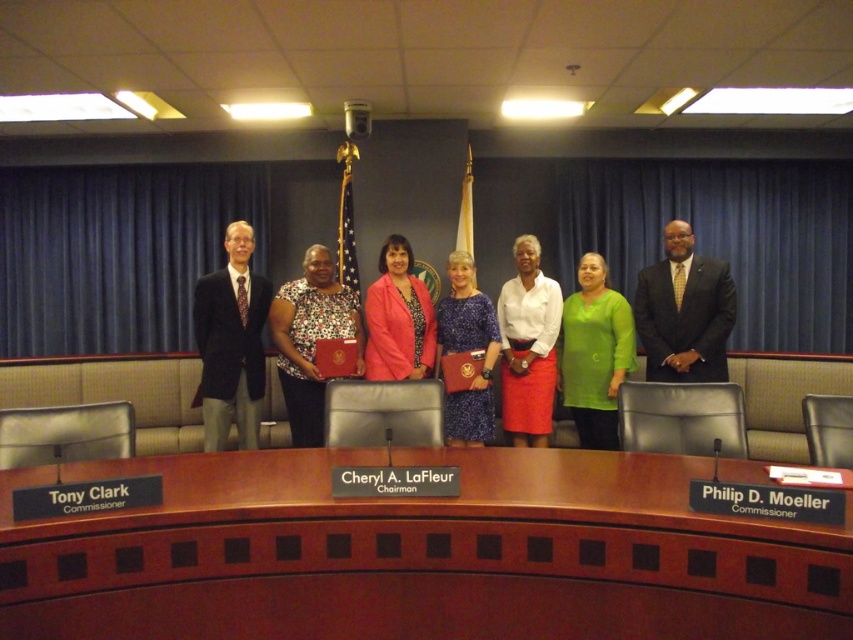
Question: Among these objects, which one is nearest to the camera?

Choices:
 (A) brown wood table at center
 (B) blue satin dress at center
 (C) matte black suit at center

Answer: (A)

Question: Which point is closer to the camera?

Choices:
 (A) matte black suit at center
 (B) floral print dress at center

Answer: (B)

Question: Can you confirm if matte black suit at center is positioned to the left of floral print dress at center?

Choices:
 (A) no
 (B) yes

Answer: (A)

Question: Which is nearer to the brown wood table at center?

Choices:
 (A) matte black suit at center
 (B) green matte shirt at center
 (C) white matte blouse at center
 (D) blue satin dress at center

Answer: (D)

Question: Can you confirm if dark gray suit at left is positioned below matte black suit at center?

Choices:
 (A) yes
 (B) no

Answer: (A)

Question: Is brown wood table at center closer to the viewer compared to green matte shirt at center?

Choices:
 (A) no
 (B) yes

Answer: (B)